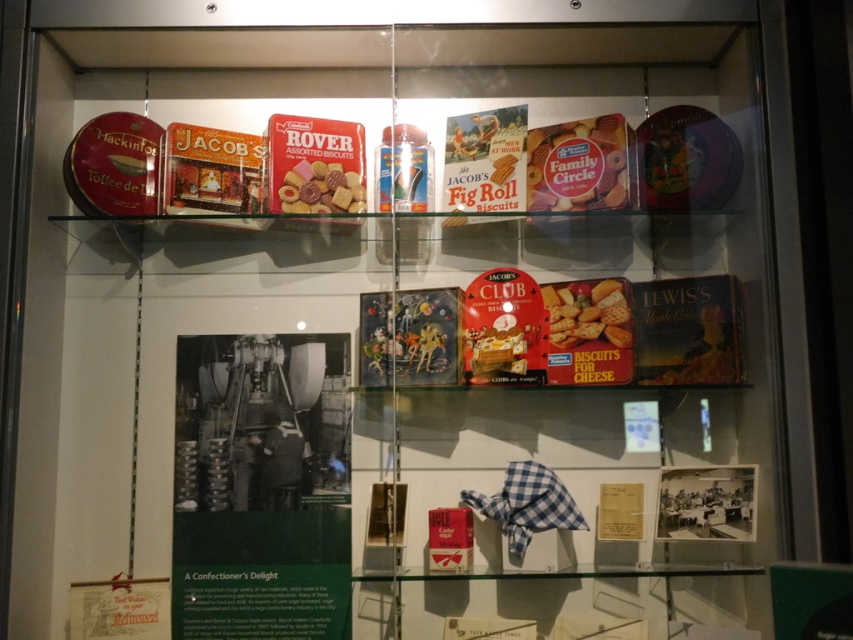
You are a museum visitor looking at the top shelf of the display case. You see the matte red box at upper center and the matte plastic assorted biscuits at upper center. Which item is located to the right of the other?

The matte red box at upper center is positioned on the right side of the matte plastic assorted biscuits at upper center.

You are a museum visitor looking at the display case. You notice the matte red box at upper center and the matte cardboard biscuit at center. Which object is placed higher on the shelf?

The matte red box at upper center is positioned over the matte cardboard biscuit at center, so it is placed higher on the shelf.

You are a museum visitor looking at the display case. You notice two items inside the case. One is the matte red box at upper center and the other is the matte cardboard biscuit at center. Which item is closer to you?

The matte red box at upper center is closer to you because it is further to the viewer than the matte cardboard biscuit at center.